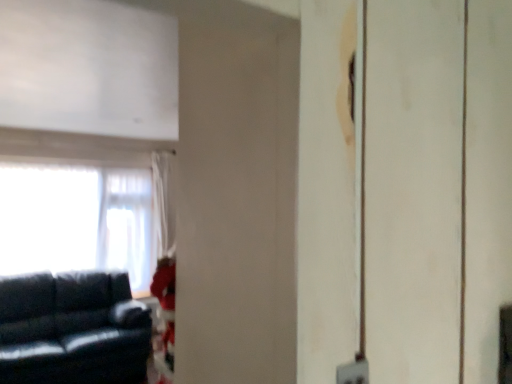
Question: From a real-world perspective, relative to matte black couch at left, is white sheer curtain at left vertically above or below?

Choices:
 (A) above
 (B) below

Answer: (A)

Question: From their relative heights in the image, would you say white sheer curtain at left is taller or shorter than matte black couch at left?

Choices:
 (A) tall
 (B) short

Answer: (A)

Question: Considering the relative positions of white sheer curtain at left and matte black couch at left in the image provided, is white sheer curtain at left to the left or to the right of matte black couch at left?

Choices:
 (A) left
 (B) right

Answer: (A)

Question: Is matte black couch at left inside the boundaries of white sheer curtain at left, or outside?

Choices:
 (A) inside
 (B) outside

Answer: (B)

Question: Based on their sizes in the image, would you say matte black couch at left is bigger or smaller than white sheer curtain at left?

Choices:
 (A) small
 (B) big

Answer: (B)

Question: From a real-world perspective, is matte black couch at left above or below white sheer curtain at left?

Choices:
 (A) above
 (B) below

Answer: (B)

Question: Relative to white sheer curtain at left, is matte black couch at left in front or behind?

Choices:
 (A) front
 (B) behind

Answer: (A)